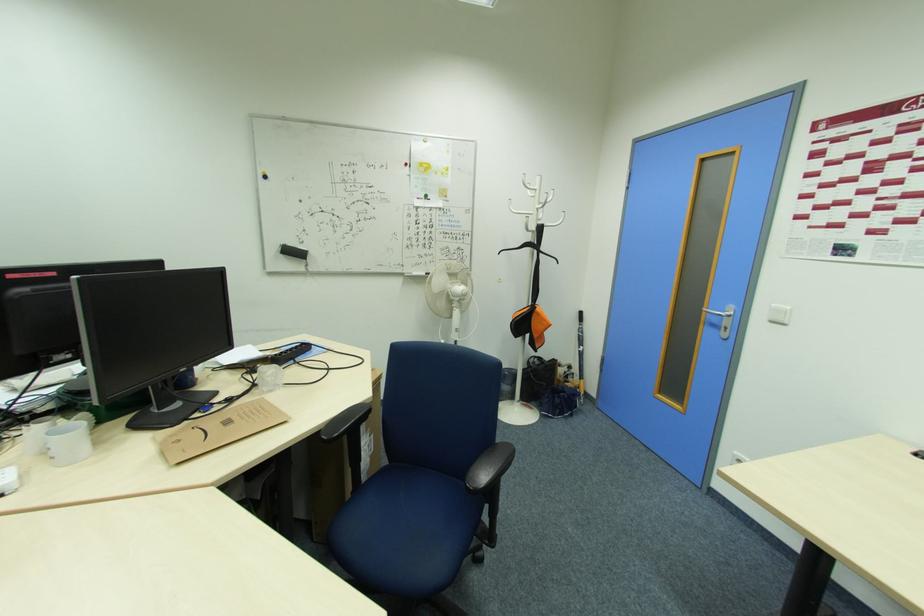
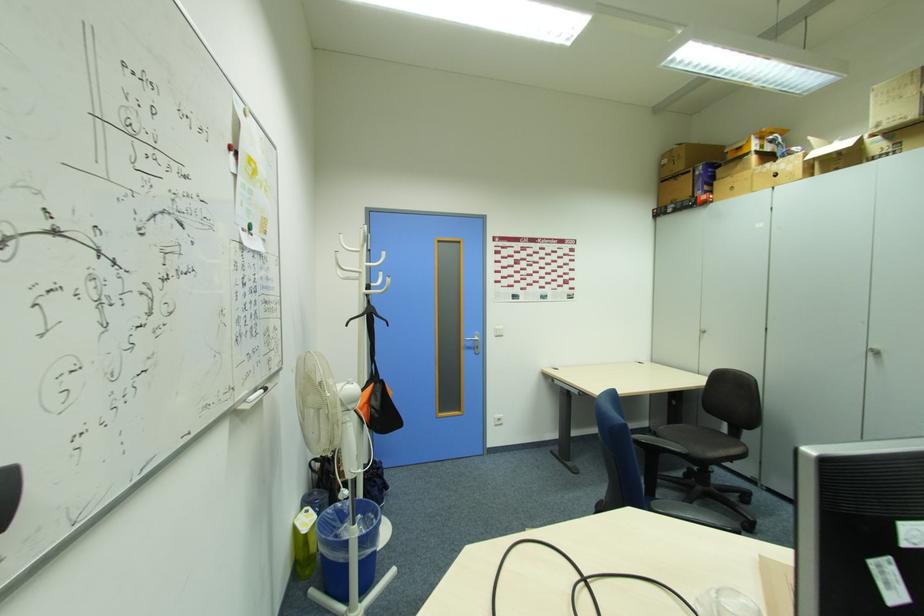
Where in the second image is the point corresponding to pixel 719 322 from the first image?

(472, 346)